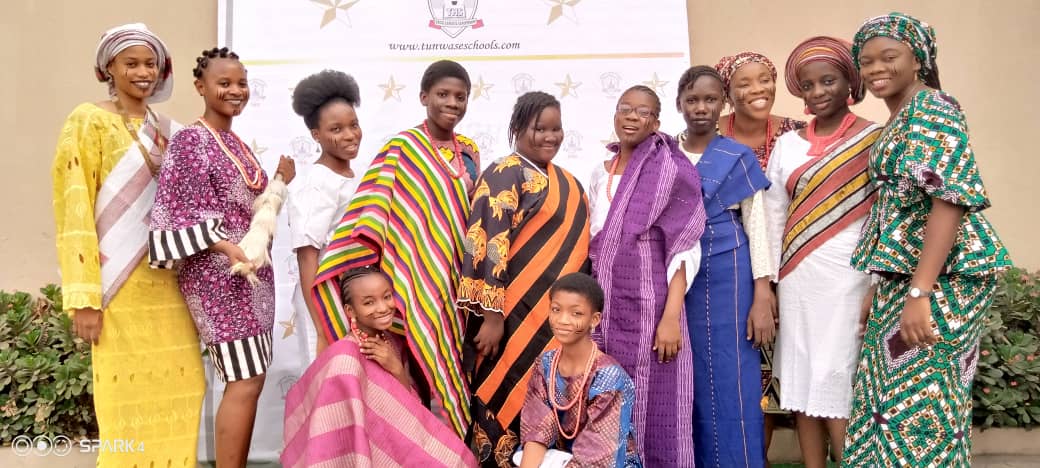
What are the coordinates of `gray planters` in the screenshot? It's located at (1016, 443), (788, 444), (50, 453).